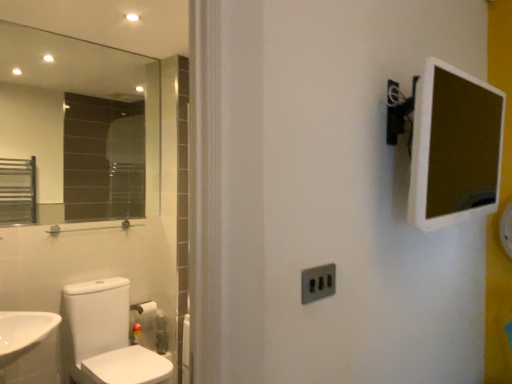
Question: Is white plastic mirror at upper right in front of satin silver switch at center?

Choices:
 (A) no
 (B) yes

Answer: (B)

Question: Is white plastic mirror at upper right oriented towards satin silver switch at center?

Choices:
 (A) no
 (B) yes

Answer: (A)

Question: Is white plastic mirror at upper right outside of satin silver switch at center?

Choices:
 (A) no
 (B) yes

Answer: (B)

Question: Is satin silver switch at center completely or partially inside white plastic mirror at upper right?

Choices:
 (A) no
 (B) yes

Answer: (A)

Question: Can you confirm if white plastic mirror at upper right is thinner than satin silver switch at center?

Choices:
 (A) yes
 (B) no

Answer: (B)

Question: From the image's perspective, is white plastic mirror at upper right located above satin silver switch at center?

Choices:
 (A) yes
 (B) no

Answer: (A)

Question: Does clear glass mirror at upper left have a greater width compared to satin silver switch at center?

Choices:
 (A) no
 (B) yes

Answer: (B)

Question: Is clear glass mirror at upper left positioned before satin silver switch at center?

Choices:
 (A) yes
 (B) no

Answer: (B)

Question: From a real-world perspective, is clear glass mirror at upper left over satin silver switch at center?

Choices:
 (A) no
 (B) yes

Answer: (B)

Question: Can you confirm if clear glass mirror at upper left is thinner than satin silver switch at center?

Choices:
 (A) yes
 (B) no

Answer: (B)

Question: Considering the relative sizes of clear glass mirror at upper left and satin silver switch at center in the image provided, is clear glass mirror at upper left taller than satin silver switch at center?

Choices:
 (A) no
 (B) yes

Answer: (B)

Question: Is clear glass mirror at upper left touching satin silver switch at center?

Choices:
 (A) no
 (B) yes

Answer: (A)

Question: Considering the relative sizes of satin silver switch at center and white glossy toilet at lower left in the image provided, is satin silver switch at center smaller than white glossy toilet at lower left?

Choices:
 (A) no
 (B) yes

Answer: (B)